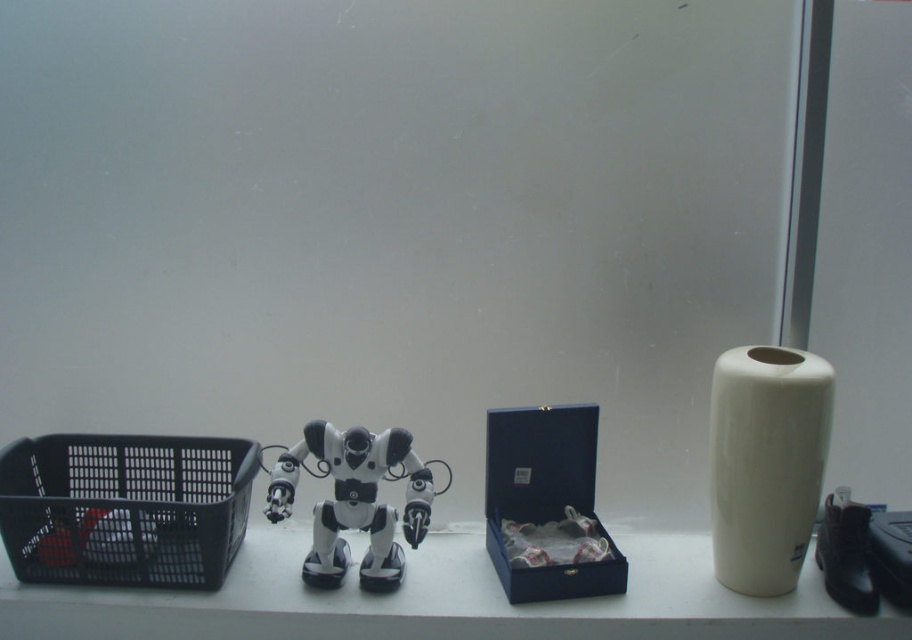
Question: Does black plastic basket at left appear on the left side of matte blue box at center?

Choices:
 (A) yes
 (B) no

Answer: (A)

Question: Which of the following is the farthest from the observer?

Choices:
 (A) metallic silver robot at center
 (B) white matte window sill at center
 (C) black plastic basket at left

Answer: (A)

Question: Observing the image, what is the correct spatial positioning of white plastic robot at center in reference to metallic silver robot at center?

Choices:
 (A) below
 (B) above

Answer: (A)

Question: Among these objects, which one is farthest from the camera?

Choices:
 (A) black matte shoe at lower right
 (B) white plastic robot at center
 (C) matte blue box at center
 (D) white matte window sill at center

Answer: (C)

Question: Is black matte shoe at lower right below metallic silver robot at center?

Choices:
 (A) yes
 (B) no

Answer: (A)

Question: Which point appears farthest from the camera in this image?

Choices:
 (A) (560, 483)
 (B) (272, 444)

Answer: (B)